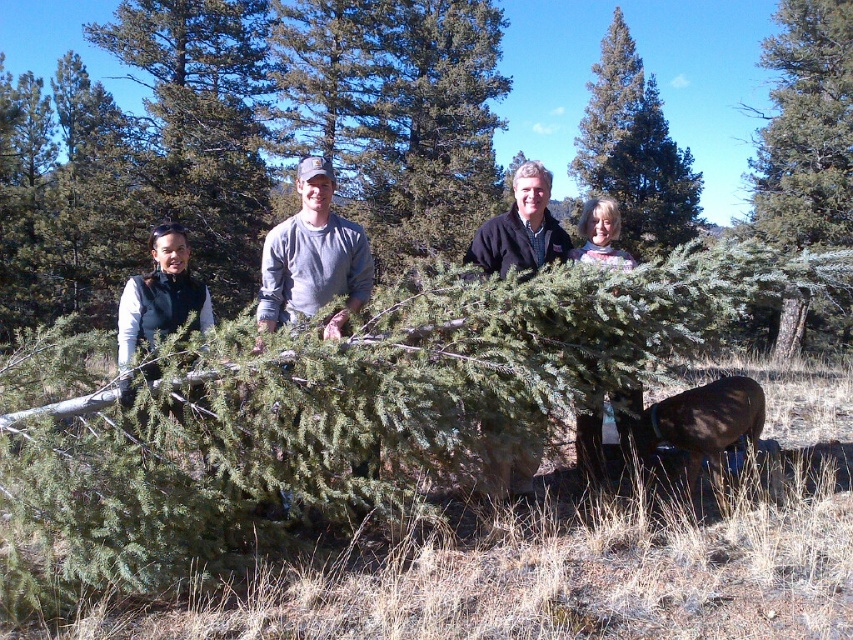
Does gray cotton shirt at center have a smaller size compared to black fleece jacket at center?

Yes, gray cotton shirt at center is smaller than black fleece jacket at center.

Does gray cotton shirt at center have a greater height compared to black fleece jacket at center?

In fact, gray cotton shirt at center may be shorter than black fleece jacket at center.

Does point (308, 170) come behind point (531, 218)?

No.

Where is `gray cotton shirt at center`? Image resolution: width=853 pixels, height=640 pixels. gray cotton shirt at center is located at coordinates (312, 257).

Is green leafy tree at center closer to the viewer compared to gray cotton shirt at center?

No, green leafy tree at center is behind gray cotton shirt at center.

Does green leafy tree at center have a lesser width compared to gray cotton shirt at center?

No.

At what (x,y) coordinates should I click in order to perform the action: click on green leafy tree at center. Please return your answer as a coordinate pair (x, y). The width and height of the screenshot is (853, 640). Looking at the image, I should click on (805, 129).

The width and height of the screenshot is (853, 640). In order to click on green leafy tree at center in this screenshot , I will do `click(805, 129)`.

Is green leafy tree at center positioned in front of black fleece jacket at center?

Yes, it is in front of black fleece jacket at center.

Who is higher up, green leafy tree at center or black fleece jacket at center?

Positioned higher is green leafy tree at center.

Image resolution: width=853 pixels, height=640 pixels. I want to click on green leafy tree at center, so click(x=805, y=129).